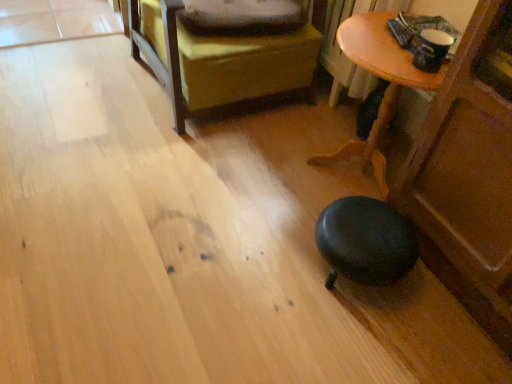
Question: From the image's perspective, is wooden table at lower right located above or below leather ottoman at center?

Choices:
 (A) below
 (B) above

Answer: (A)

Question: From a real-world perspective, is wooden table at lower right above or below leather ottoman at center?

Choices:
 (A) above
 (B) below

Answer: (B)

Question: Based on their relative distances, which object is nearer to the leather ottoman at center?

Choices:
 (A) wooden table at lower right
 (B) soft gray pillow at upper center

Answer: (B)

Question: Which of these objects is positioned closest to the wooden table at lower right?

Choices:
 (A) soft gray pillow at upper center
 (B) leather ottoman at center

Answer: (B)